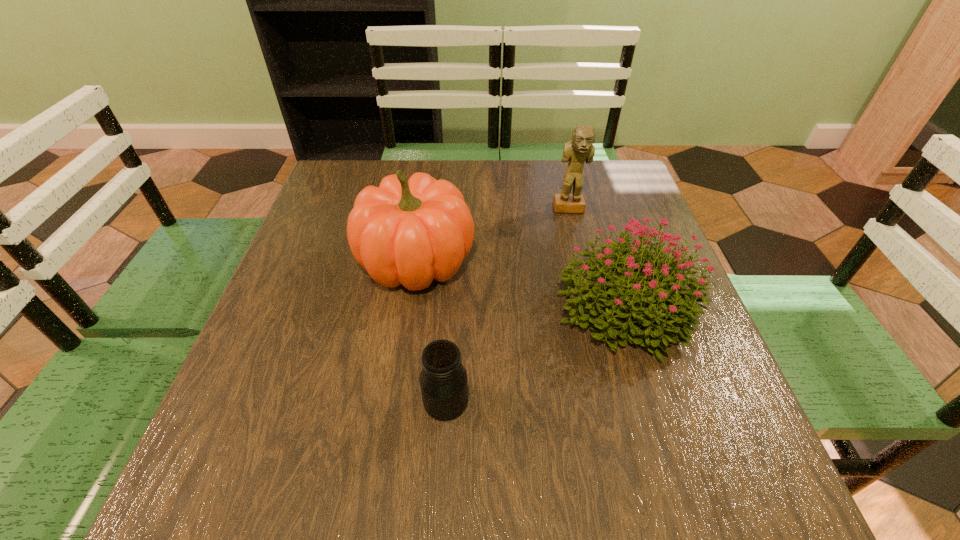
This screenshot has height=540, width=960. What are the coordinates of `free spot between the nearest object and the bouquet` in the screenshot? It's located at (535, 354).

I want to click on free space between the jar and the bouquet, so click(535, 354).

At what (x,y) coordinates should I click in order to perform the action: click on free spot between the nearest object and the farthest object. Please return your answer as a coordinate pair (x, y). The width and height of the screenshot is (960, 540). Looking at the image, I should click on (507, 305).

What are the coordinates of `free space between the nearest object and the bouquet` in the screenshot? It's located at (535, 354).

The image size is (960, 540). I want to click on vacant space that is in between the pumpkin and the nearest object, so click(x=431, y=331).

Where is `free space between the shortest object and the pumpkin`? The height and width of the screenshot is (540, 960). free space between the shortest object and the pumpkin is located at coordinates point(431,331).

Identify the location of free space between the nearest object and the figurine. The width and height of the screenshot is (960, 540). (507, 305).

Identify which object is located as the second nearest to the bouquet. Please provide its 2D coordinates. Your answer should be formatted as a tuple, i.e. [(x, y)], where the tuple contains the x and y coordinates of a point satisfying the conditions above.

[(404, 232)]

Locate an element on the screen. The height and width of the screenshot is (540, 960). object that is the third closest one to the pumpkin is located at coordinates (580, 149).

Image resolution: width=960 pixels, height=540 pixels. What are the coordinates of `free space that satisfies the following two spatial constraints: 1. on the front-facing side of the farthest object; 2. on the left side of the bouquet` in the screenshot? It's located at (592, 306).